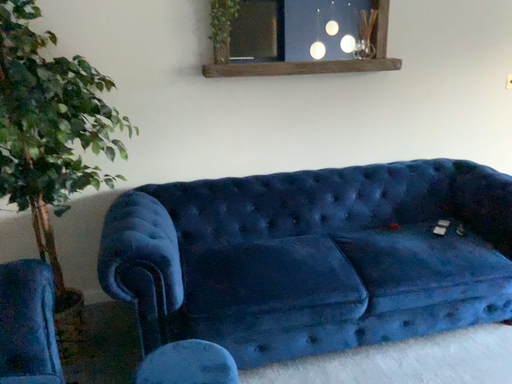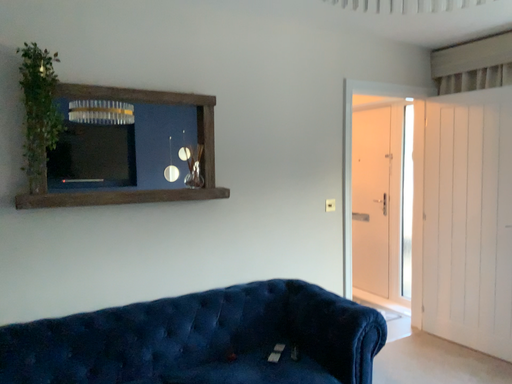
Question: Which way did the camera rotate in the video?

Choices:
 (A) rotated right
 (B) rotated left

Answer: (A)